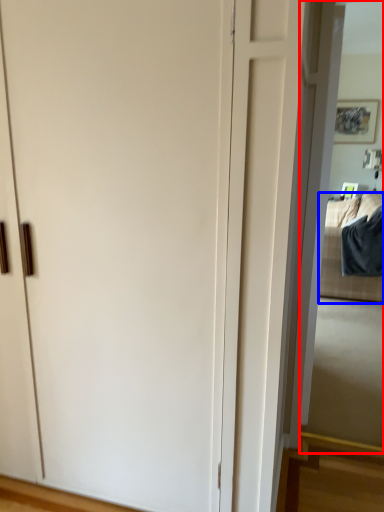
Question: Which point is closer to the camera, mirror (highlighted by a red box) or bedding (highlighted by a blue box)?

Choices:
 (A) mirror
 (B) bedding

Answer: (A)